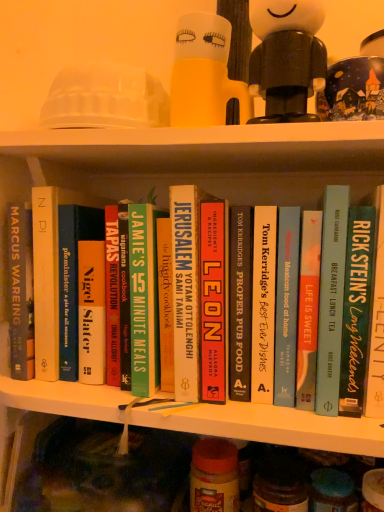
Find the location of a particular element. This screenshot has width=384, height=512. vacant area that is in front of white hardcover book at center, the 1th book when ordered from left to right is located at coordinates (73, 396).